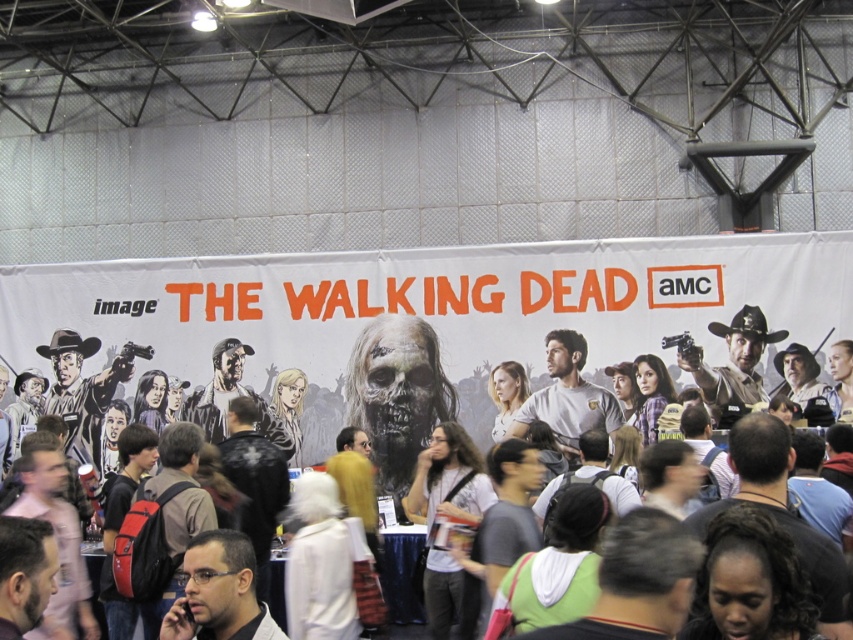
Which is below, white matte banner at center or matte black backpack at center?

matte black backpack at center is lower down.

Which of these two, white matte banner at center or matte black backpack at center, stands taller?

matte black backpack at center

Is point (645, 340) positioned before point (393, 493)?

No, (645, 340) is behind (393, 493).

Locate an element on the screen. This screenshot has height=640, width=853. white matte banner at center is located at coordinates (x=399, y=328).